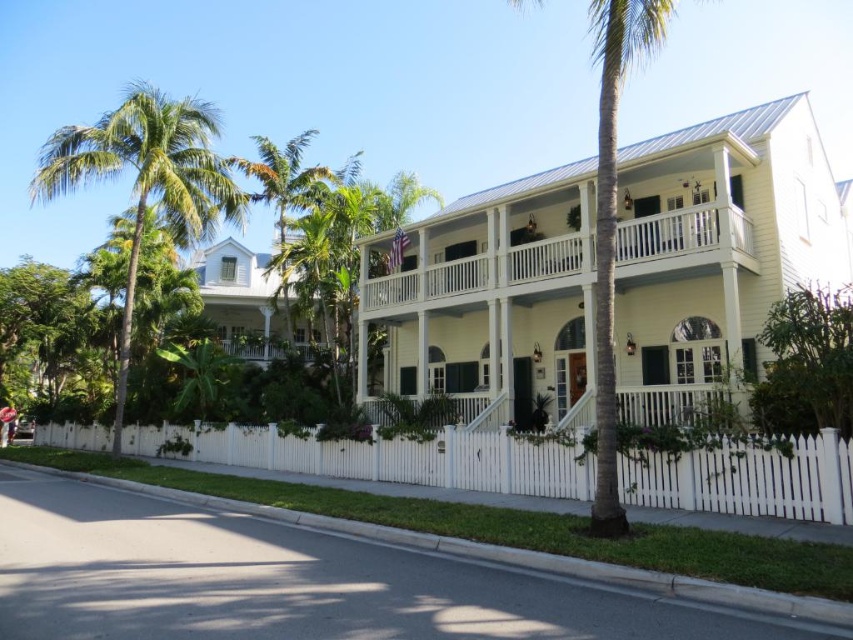
Can you confirm if white picket fence at lower center is shorter than green leafy palm tree at center?

Indeed, white picket fence at lower center has a lesser height compared to green leafy palm tree at center.

Between point (566, 492) and point (622, 12), which one is positioned behind?

Positioned behind is point (566, 492).

Does point (770, 486) come closer to viewer compared to point (605, 273)?

No, it is behind (605, 273).

You are a GUI agent. You are given a task and a screenshot of the screen. Output one action in this format:
    pyautogui.click(x=<x>, y=<y>)
    Task: Click on the white picket fence at lower center
    This screenshot has height=640, width=853.
    Given the screenshot: What is the action you would take?
    pyautogui.click(x=384, y=458)

Is green leafy palm tree at left to the right of green leafy palm tree at center from the viewer's perspective?

In fact, green leafy palm tree at left is to the left of green leafy palm tree at center.

Can you confirm if green leafy palm tree at left is wider than green leafy palm tree at center?

Correct, the width of green leafy palm tree at left exceeds that of green leafy palm tree at center.

Who is more distant from viewer, (143, 211) or (596, 467)?

The point (143, 211) is more distant.

Where is `green leafy palm tree at left`? Image resolution: width=853 pixels, height=640 pixels. green leafy palm tree at left is located at coordinates (146, 180).

Measure the distance between point (599, 228) and camera.

They are 8.44 meters apart.

Can you confirm if green leafy palm tree at center is positioned to the left of green leafy palm tree at upper left?

In fact, green leafy palm tree at center is to the right of green leafy palm tree at upper left.

This screenshot has height=640, width=853. I want to click on green leafy palm tree at center, so click(612, 224).